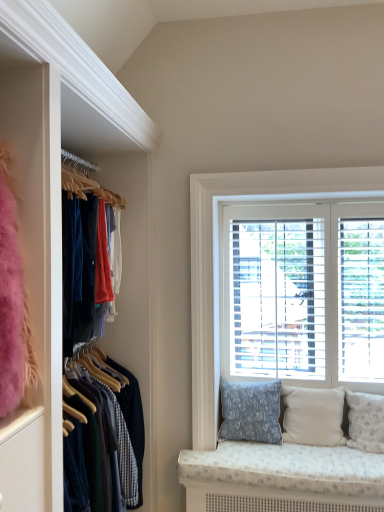
Question: Is blue floral fabric pillow at lower right, marked as the first pillow in a left-to-right arrangement, in front of beige fabric pillow at lower right, placed as the 2th pillow when sorted from left to right?

Choices:
 (A) yes
 (B) no

Answer: (B)

Question: Is blue floral fabric pillow at lower right, marked as the first pillow in a left-to-right arrangement, not close to beige fabric pillow at lower right, placed as the 2th pillow when sorted from left to right?

Choices:
 (A) yes
 (B) no

Answer: (B)

Question: From a real-world perspective, is blue floral fabric pillow at lower right, which is counted as the 3th pillow, starting from the right, located beneath beige fabric pillow at lower right, placed as the 2th pillow when sorted from left to right?

Choices:
 (A) yes
 (B) no

Answer: (B)

Question: Is blue floral fabric pillow at lower right, marked as the first pillow in a left-to-right arrangement, surrounding beige fabric pillow at lower right, positioned as the 2th pillow in right-to-left order?

Choices:
 (A) yes
 (B) no

Answer: (B)

Question: Is blue floral fabric pillow at lower right, marked as the first pillow in a left-to-right arrangement, bigger than beige fabric pillow at lower right, placed as the 2th pillow when sorted from left to right?

Choices:
 (A) yes
 (B) no

Answer: (A)

Question: Relative to white wood blinds at upper right, is blue floral fabric pillow at lower right, which is counted as the 3th pillow, starting from the right, in front or behind?

Choices:
 (A) behind
 (B) front

Answer: (B)

Question: Based on their sizes in the image, would you say blue floral fabric pillow at lower right, marked as the first pillow in a left-to-right arrangement, is bigger or smaller than white wood blinds at upper right?

Choices:
 (A) small
 (B) big

Answer: (A)

Question: Considering the positions of blue floral fabric pillow at lower right, marked as the first pillow in a left-to-right arrangement, and white wood blinds at upper right in the image, is blue floral fabric pillow at lower right, marked as the first pillow in a left-to-right arrangement, taller or shorter than white wood blinds at upper right?

Choices:
 (A) short
 (B) tall

Answer: (A)

Question: From a real-world perspective, is blue floral fabric pillow at lower right, marked as the first pillow in a left-to-right arrangement, above or below white wood blinds at upper right?

Choices:
 (A) above
 (B) below

Answer: (B)

Question: From a real-world perspective, is beige fabric pillow at lower right, positioned as the 2th pillow in right-to-left order, positioned above or below blue floral fabric pillow at lower right, marked as the first pillow in a left-to-right arrangement?

Choices:
 (A) above
 (B) below

Answer: (B)

Question: Would you say beige fabric pillow at lower right, positioned as the 2th pillow in right-to-left order, is inside or outside blue floral fabric pillow at lower right, which is counted as the 3th pillow, starting from the right?

Choices:
 (A) inside
 (B) outside

Answer: (B)

Question: From the image's perspective, relative to blue floral fabric pillow at lower right, which is counted as the 3th pillow, starting from the right, is beige fabric pillow at lower right, placed as the 2th pillow when sorted from left to right, above or below?

Choices:
 (A) above
 (B) below

Answer: (B)

Question: Considering the positions of beige fabric pillow at lower right, positioned as the 2th pillow in right-to-left order, and blue floral fabric pillow at lower right, which is counted as the 3th pillow, starting from the right, in the image, is beige fabric pillow at lower right, positioned as the 2th pillow in right-to-left order, bigger or smaller than blue floral fabric pillow at lower right, which is counted as the 3th pillow, starting from the right,?

Choices:
 (A) big
 (B) small

Answer: (B)

Question: From the image's perspective, relative to white fabric pillow at lower right, acting as the first pillow starting from the right, is white wood blinds at upper right above or below?

Choices:
 (A) above
 (B) below

Answer: (A)

Question: Based on their sizes in the image, would you say white wood blinds at upper right is bigger or smaller than white fabric pillow at lower right, acting as the first pillow starting from the right?

Choices:
 (A) big
 (B) small

Answer: (A)